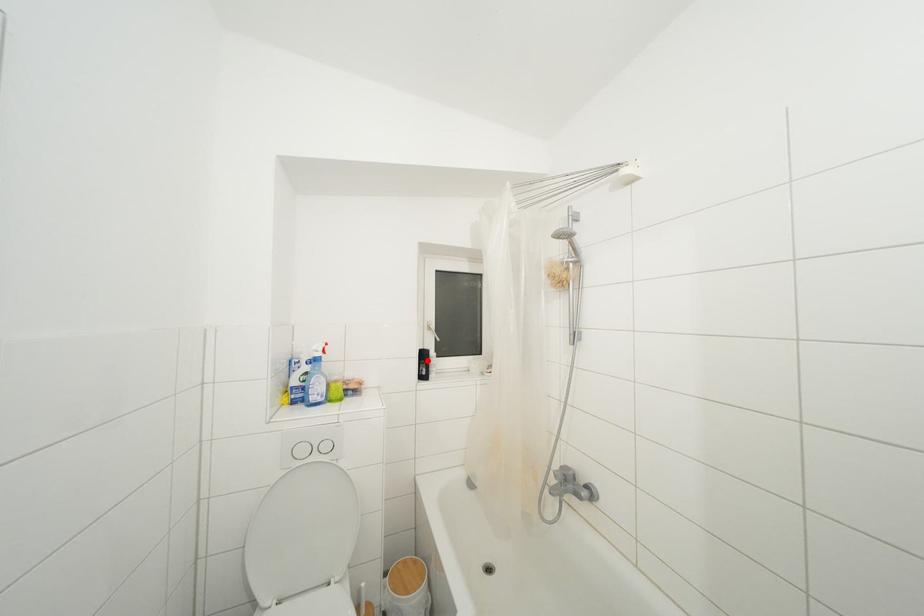
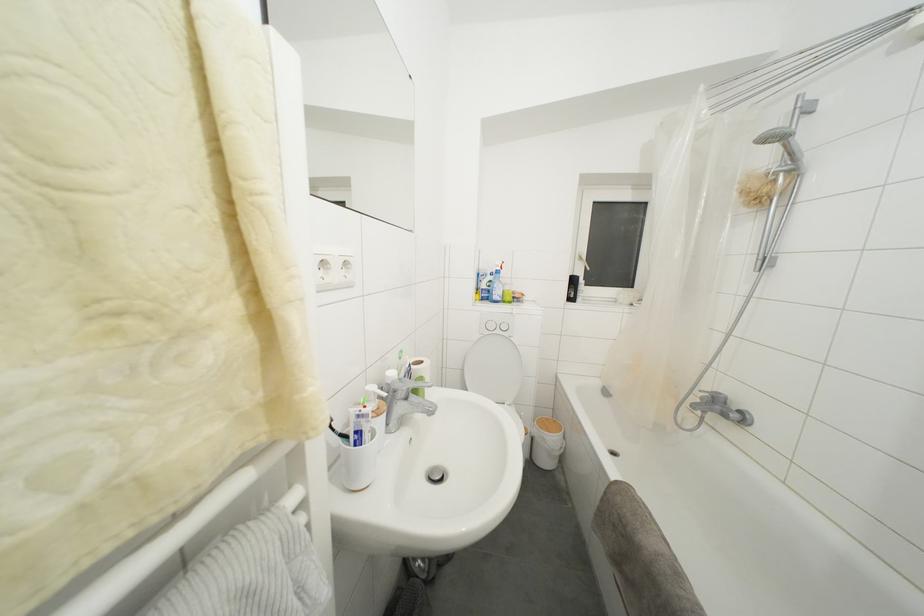
Question: I am providing you with two images of the same scene from different viewpoints. In image1, a red point is highlighted. Considering the same 3D point in image2, which of the following is correct?

Choices:
 (A) It is closer
 (B) It is farther

Answer: (A)